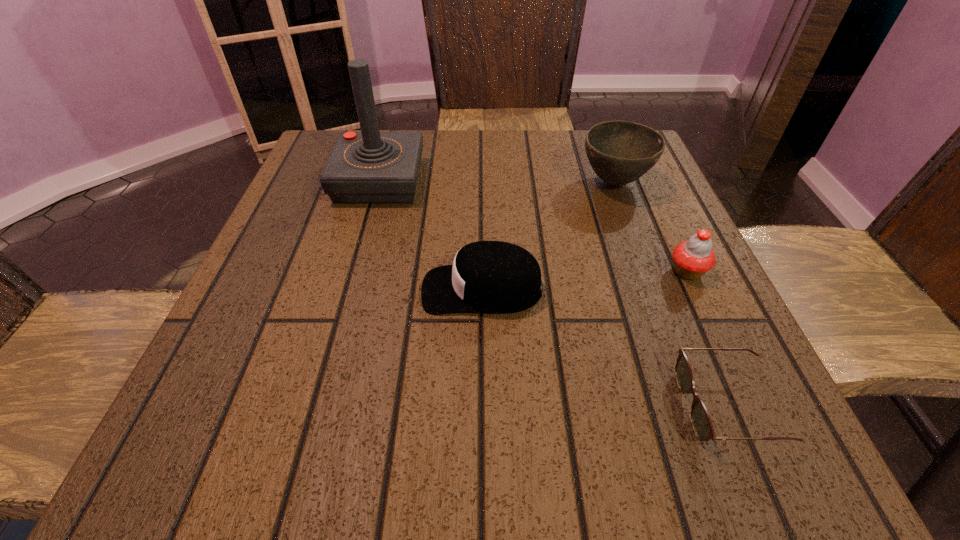
The height and width of the screenshot is (540, 960). Identify the location of bowl located at the right edge. (620, 152).

Where is `cupcake located at the right edge`? This screenshot has height=540, width=960. cupcake located at the right edge is located at coordinates (692, 258).

You are a GUI agent. You are given a task and a screenshot of the screen. Output one action in this format:
    pyautogui.click(x=<x>, y=<y>)
    Task: Click on the spectacles located in the right edge section of the desktop
    The height and width of the screenshot is (540, 960).
    Given the screenshot: What is the action you would take?
    pyautogui.click(x=702, y=425)

Identify the location of object at the far left corner. (369, 167).

Where is `object located at the far right corner`? This screenshot has width=960, height=540. object located at the far right corner is located at coordinates (620, 152).

This screenshot has width=960, height=540. I want to click on object situated at the near right corner, so click(702, 425).

Image resolution: width=960 pixels, height=540 pixels. In the image, there is a desktop. Find the location of `vacant region at the far edge`. vacant region at the far edge is located at coordinates (549, 132).

I want to click on vacant space at the near edge of the desktop, so click(x=456, y=437).

Find the location of a particular element. Image resolution: width=960 pixels, height=540 pixels. vacant space at the left edge is located at coordinates pyautogui.click(x=296, y=327).

What are the coordinates of `free region at the right edge of the desktop` in the screenshot? It's located at (683, 397).